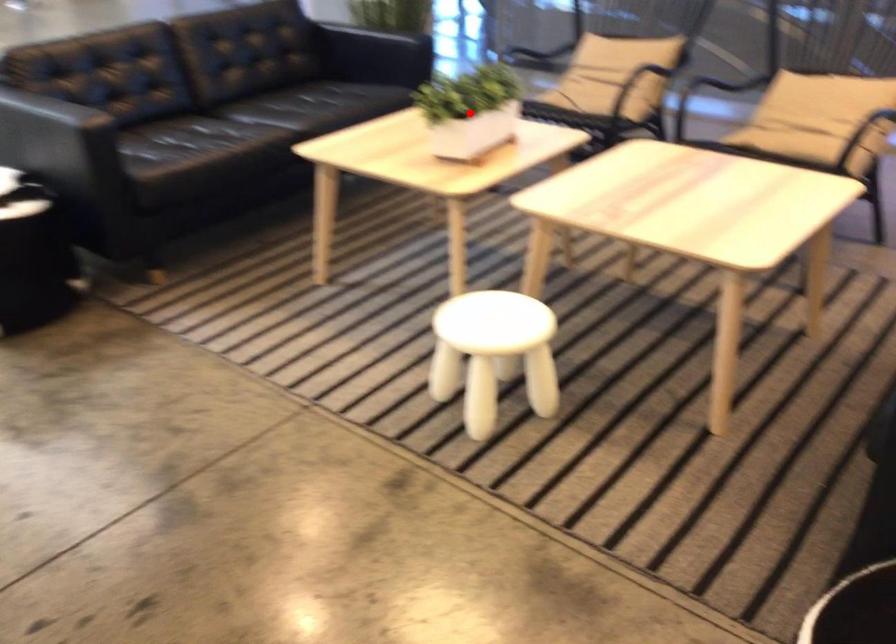
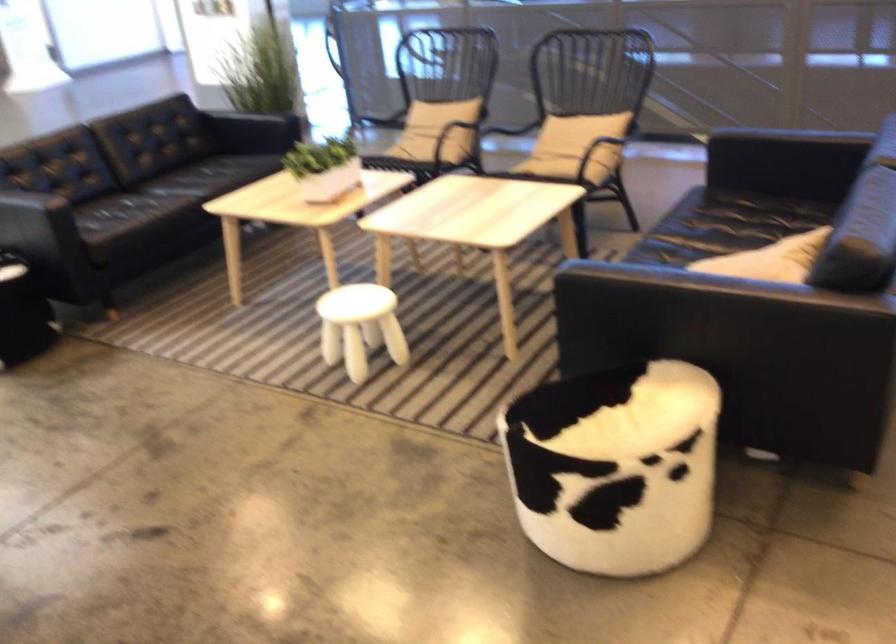
Question: I am providing you with two images of the same scene from different viewpoints. A red point is marked on the first image. Can you still see the location of the red point in image 2?

Choices:
 (A) Yes
 (B) No

Answer: (A)